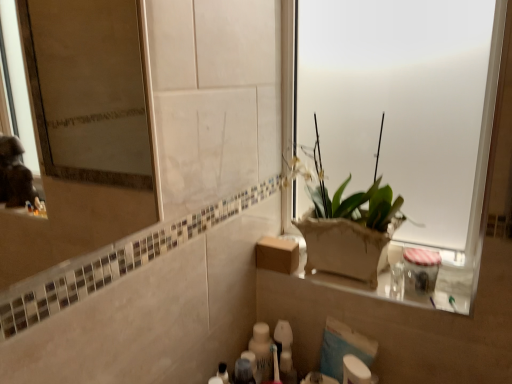
Question: Does white glossy bottle at lower center, which is the 2th toiletry in left-to-right order, have a greater width compared to white frosted glass at upper right?

Choices:
 (A) no
 (B) yes

Answer: (B)

Question: From the image's perspective, would you say white glossy bottle at lower center, which ranks as the 3th toiletry in right-to-left order, is positioned over white frosted glass at upper right?

Choices:
 (A) yes
 (B) no

Answer: (B)

Question: Could white frosted glass at upper right be considered to be inside white glossy bottle at lower center, which is the 2th toiletry in left-to-right order?

Choices:
 (A) yes
 (B) no

Answer: (B)

Question: Does white glossy bottle at lower center, which ranks as the 3th toiletry in right-to-left order, appear on the right side of white frosted glass at upper right?

Choices:
 (A) yes
 (B) no

Answer: (B)

Question: Can you confirm if white glossy bottle at lower center, which ranks as the 3th toiletry in right-to-left order, is thinner than white frosted glass at upper right?

Choices:
 (A) no
 (B) yes

Answer: (A)

Question: Considering the positions of point (375, 59) and point (345, 370), is point (375, 59) closer or farther from the camera than point (345, 370)?

Choices:
 (A) closer
 (B) farther

Answer: (B)

Question: From their relative heights in the image, would you say white frosted glass at upper right is taller or shorter than white matte toilet paper at lower center?

Choices:
 (A) short
 (B) tall

Answer: (B)

Question: From a real-world perspective, is white frosted glass at upper right physically located above or below white matte toilet paper at lower center?

Choices:
 (A) below
 (B) above

Answer: (B)

Question: Considering the positions of white frosted glass at upper right and white matte toilet paper at lower center in the image, is white frosted glass at upper right wider or thinner than white matte toilet paper at lower center?

Choices:
 (A) thin
 (B) wide

Answer: (B)

Question: Is white matte toilet paper at lower center bigger or smaller than brown cardboard box at center?

Choices:
 (A) big
 (B) small

Answer: (B)

Question: Looking at their shapes, would you say white matte toilet paper at lower center is wider or thinner than brown cardboard box at center?

Choices:
 (A) wide
 (B) thin

Answer: (B)

Question: Is white matte toilet paper at lower center situated inside brown cardboard box at center or outside?

Choices:
 (A) outside
 (B) inside

Answer: (A)

Question: Is white matte toilet paper at lower center taller or shorter than brown cardboard box at center?

Choices:
 (A) short
 (B) tall

Answer: (B)

Question: Does point (339, 246) appear closer or farther from the camera than point (290, 340)?

Choices:
 (A) farther
 (B) closer

Answer: (B)

Question: From a real-world perspective, is matte brown pot at center above or below translucent plastic toothbrush at lower center, the 3th toiletry from the left?

Choices:
 (A) above
 (B) below

Answer: (A)